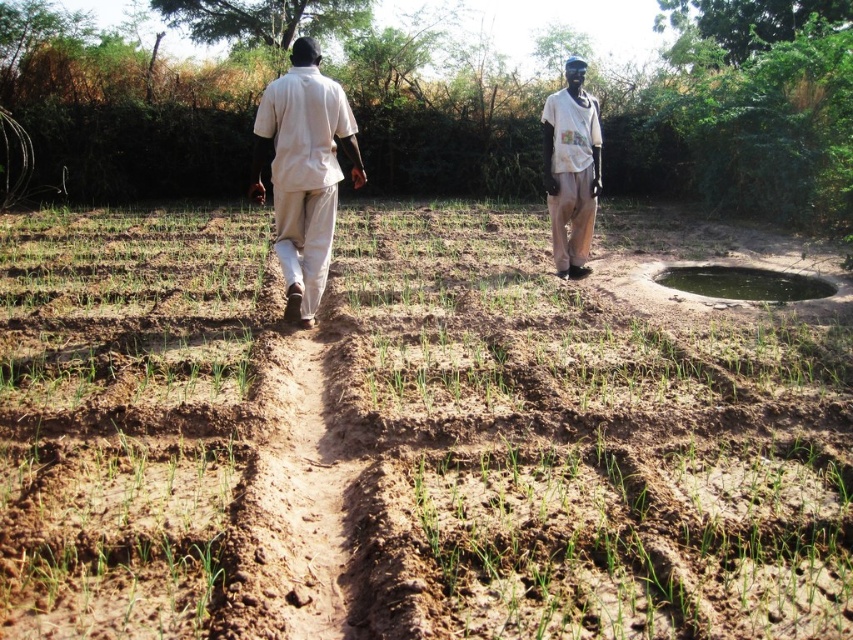
Question: Which object is farther from the camera taking this photo?

Choices:
 (A) brown soil at center
 (B) white cotton shirt at upper center
 (C) light beige cotton shirt at center

Answer: (B)

Question: Which point is closer to the camera taking this photo?

Choices:
 (A) (299, 316)
 (B) (302, 150)
 (C) (583, 97)

Answer: (B)

Question: Is light beige cotton shirt at center positioned before white cotton shirt at upper center?

Choices:
 (A) no
 (B) yes

Answer: (B)

Question: Can you confirm if brown soil at center is thinner than beige cotton shirt at center?

Choices:
 (A) no
 (B) yes

Answer: (A)

Question: Which point is closer to the camera?

Choices:
 (A) light beige cotton shirt at center
 (B) white cotton shirt at upper center
 (C) brown soil at center

Answer: (C)

Question: Does light beige cotton shirt at center lie in front of beige cotton shirt at center?

Choices:
 (A) yes
 (B) no

Answer: (B)